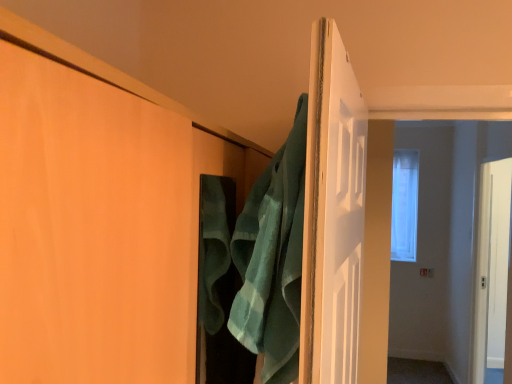
Question: Is matte wood door at center thinner than green terry cloth bath towel at center?

Choices:
 (A) yes
 (B) no

Answer: (B)

Question: Does matte wood door at center have a smaller size compared to green terry cloth bath towel at center?

Choices:
 (A) no
 (B) yes

Answer: (A)

Question: Does matte wood door at center contain green terry cloth bath towel at center?

Choices:
 (A) yes
 (B) no

Answer: (B)

Question: From a real-world perspective, is matte wood door at center physically below green terry cloth bath towel at center?

Choices:
 (A) yes
 (B) no

Answer: (A)

Question: Does matte wood door at center appear on the left side of green terry cloth bath towel at center?

Choices:
 (A) no
 (B) yes

Answer: (B)

Question: Is matte wood door at center in contact with green terry cloth bath towel at center?

Choices:
 (A) no
 (B) yes

Answer: (A)

Question: From a real-world perspective, is matte wood door at center under clear glass window at center?

Choices:
 (A) no
 (B) yes

Answer: (B)

Question: Considering the relative sizes of matte wood door at center and clear glass window at center in the image provided, is matte wood door at center smaller than clear glass window at center?

Choices:
 (A) no
 (B) yes

Answer: (A)

Question: Does matte wood door at center come behind clear glass window at center?

Choices:
 (A) no
 (B) yes

Answer: (A)

Question: Is matte wood door at center positioned beyond the bounds of clear glass window at center?

Choices:
 (A) yes
 (B) no

Answer: (A)

Question: Does matte wood door at center turn towards clear glass window at center?

Choices:
 (A) yes
 (B) no

Answer: (B)

Question: Can you confirm if matte wood door at center is bigger than clear glass window at center?

Choices:
 (A) no
 (B) yes

Answer: (B)

Question: Can you confirm if green terry cloth bath towel at center is bigger than clear glass window at center?

Choices:
 (A) no
 (B) yes

Answer: (A)